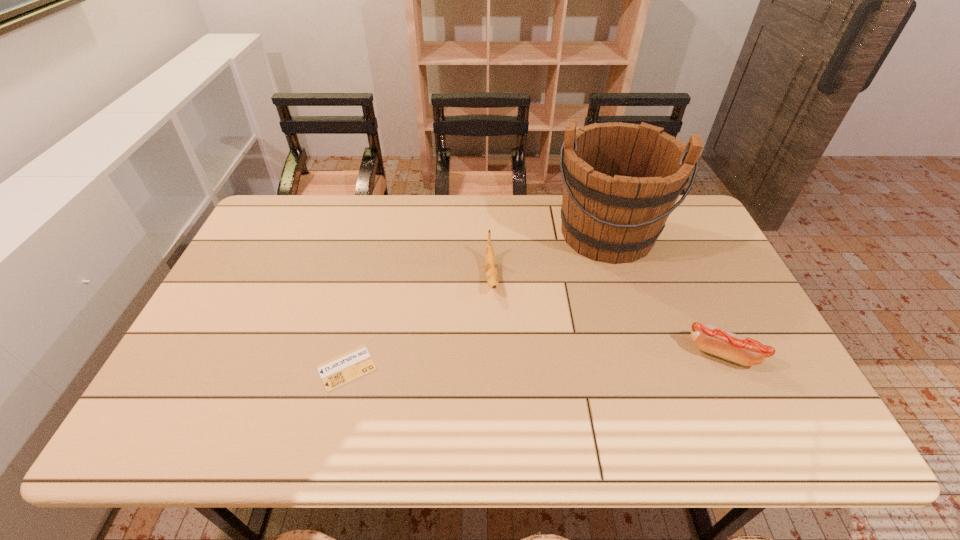
I want to click on free region that satisfies the following two spatial constraints: 1. on the back side of the shortest object; 2. on the left side of the second object from left to right, so click(x=370, y=276).